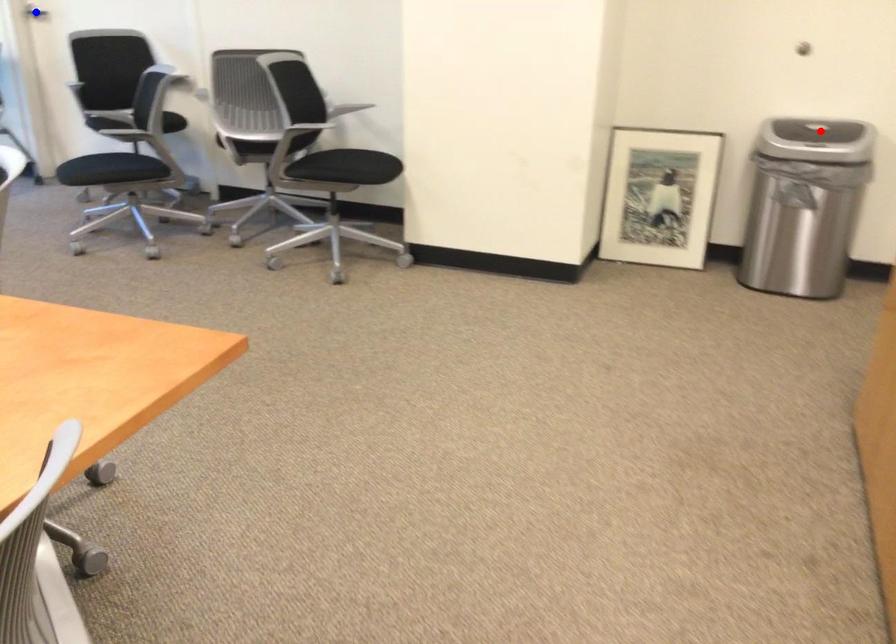
Question: In the image, two points are highlighted. Which point is nearer to the camera? Reply with the corresponding letter.

Choices:
 (A) blue point
 (B) red point

Answer: (B)